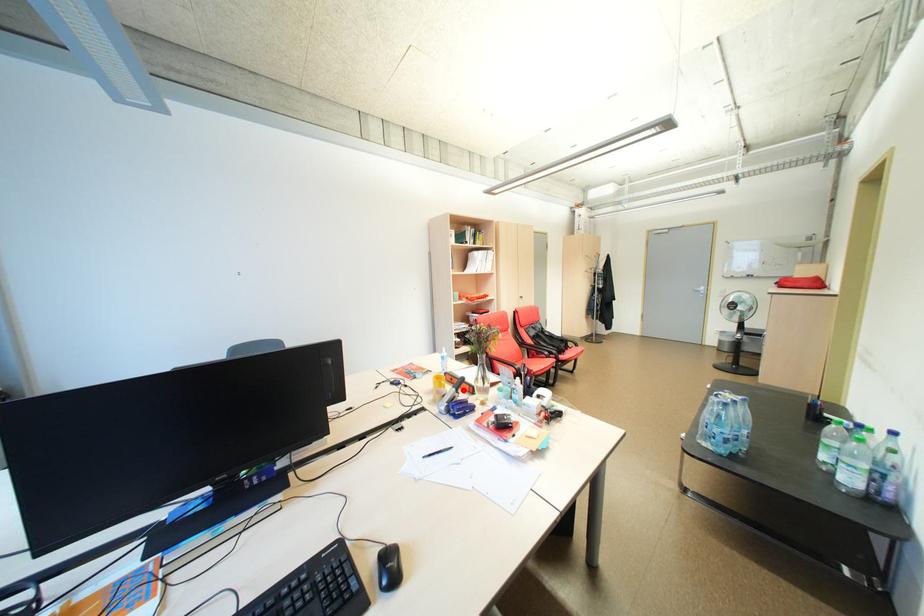
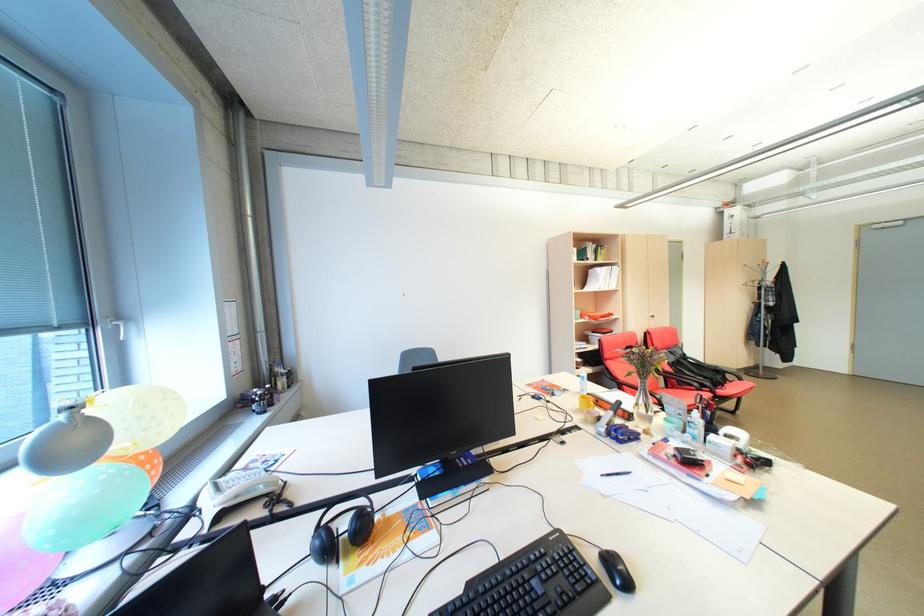
Where in the second image is the point corresponding to the highlighted location from the first image?

(621, 413)